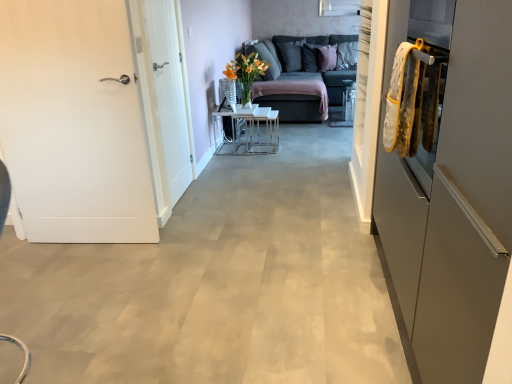
Question: Can you confirm if white wood door at left, arranged as the 2th door when viewed from the left, is thinner than white matte door at left, the second door from the right?

Choices:
 (A) yes
 (B) no

Answer: (A)

Question: Is white wood door at left, arranged as the 2th door when viewed from the left, wider than white matte door at left, which is the 1th door from left to right?

Choices:
 (A) yes
 (B) no

Answer: (B)

Question: Are white wood door at left, which appears as the first door when viewed from the right, and white matte door at left, the second door from the right, making contact?

Choices:
 (A) no
 (B) yes

Answer: (A)

Question: Is white wood door at left, which appears as the first door when viewed from the right, oriented towards white matte door at left, which is the 1th door from left to right?

Choices:
 (A) no
 (B) yes

Answer: (A)

Question: Is white wood door at left, arranged as the 2th door when viewed from the left, oriented away from white matte door at left, the second door from the right?

Choices:
 (A) yes
 (B) no

Answer: (B)

Question: Does white wood door at left, which appears as the first door when viewed from the right, appear on the left side of white matte door at left, the second door from the right?

Choices:
 (A) no
 (B) yes

Answer: (A)

Question: Is white matte door at left, which is the 1th door from left to right, in contact with white wood door at left, which appears as the first door when viewed from the right?

Choices:
 (A) no
 (B) yes

Answer: (A)

Question: From a real-world perspective, is white matte door at left, which is the 1th door from left to right, located higher than white wood door at left, which appears as the first door when viewed from the right?

Choices:
 (A) no
 (B) yes

Answer: (A)

Question: Does white matte door at left, the second door from the right, have a greater width compared to white wood door at left, which appears as the first door when viewed from the right?

Choices:
 (A) no
 (B) yes

Answer: (B)

Question: Is white matte door at left, the second door from the right, thinner than white wood door at left, arranged as the 2th door when viewed from the left?

Choices:
 (A) yes
 (B) no

Answer: (B)

Question: Is white wood door at left, which appears as the first door when viewed from the right, surrounded by white matte door at left, the second door from the right?

Choices:
 (A) yes
 (B) no

Answer: (B)

Question: Is white matte door at left, which is the 1th door from left to right, smaller than white wood door at left, which appears as the first door when viewed from the right?

Choices:
 (A) no
 (B) yes

Answer: (A)

Question: From a real-world perspective, is white matte door at left, the second door from the right, positioned under dark gray fabric pillow at upper center, positioned as the first pillow in left-to-right order, based on gravity?

Choices:
 (A) no
 (B) yes

Answer: (B)